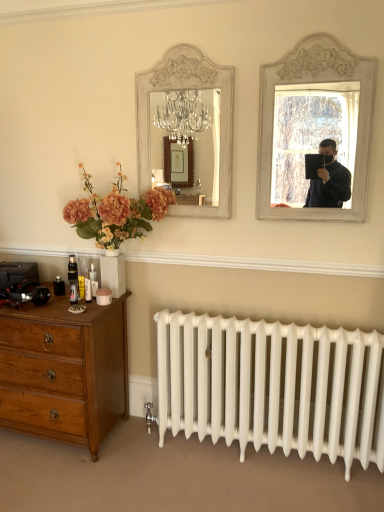
The image size is (384, 512). What are the coordinates of `vacant space situated above white painted wood mirror at upper center (from a real-world perspective)` in the screenshot? It's located at (177, 41).